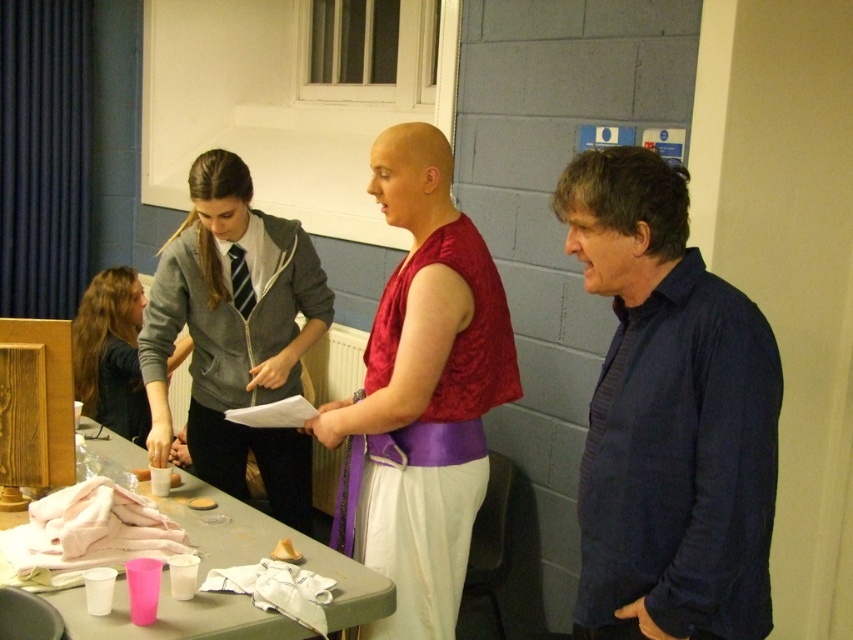
Is gray fleece jacket at center wider than matte gray hoodie at center?

Indeed, gray fleece jacket at center has a greater width compared to matte gray hoodie at center.

Is the position of gray fleece jacket at center more distant than that of matte gray hoodie at center?

No.

Where is `gray fleece jacket at center`? gray fleece jacket at center is located at coordinates [x=235, y=333].

Can you confirm if shiny red fabric top at center is thinner than gray fleece jacket at center?

Yes.

Does shiny red fabric top at center have a lesser height compared to gray fleece jacket at center?

No, shiny red fabric top at center is not shorter than gray fleece jacket at center.

What do you see at coordinates (421, 394) in the screenshot?
I see `shiny red fabric top at center` at bounding box center [421, 394].

Find the location of a particular element. The image size is (853, 640). shiny red fabric top at center is located at coordinates (421, 394).

In the scene shown: Is shiny red fabric top at center positioned at the back of matte gray hoodie at center?

No, shiny red fabric top at center is in front of matte gray hoodie at center.

The width and height of the screenshot is (853, 640). What do you see at coordinates (421, 394) in the screenshot? I see `shiny red fabric top at center` at bounding box center [421, 394].

Describe the element at coordinates (421, 394) in the screenshot. I see `shiny red fabric top at center` at that location.

Find the location of `shiny red fabric top at center`. shiny red fabric top at center is located at coordinates (421, 394).